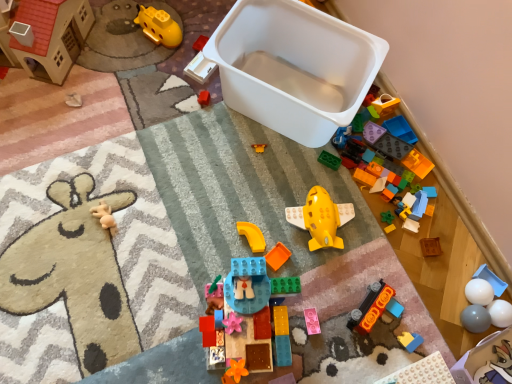
The image size is (512, 384). In order to click on free space in front of beige rubber bear at left, which ranks as the 15th toy in right-to-left order in this screenshot , I will do `click(84, 276)`.